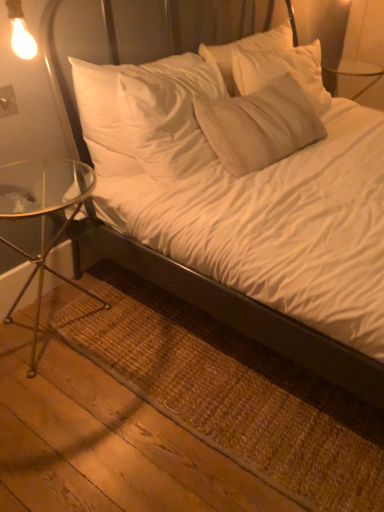
Find the location of `white soft bed at center`. white soft bed at center is located at coordinates (233, 310).

What do you see at coordinates (43, 214) in the screenshot? Image resolution: width=384 pixels, height=512 pixels. I see `clear glass table at left` at bounding box center [43, 214].

The height and width of the screenshot is (512, 384). In order to click on white soft bed at center in this screenshot , I will do `click(233, 310)`.

Which of these two, brown woven mat at lower left or clear glass table at left, is smaller?

Smaller between the two is brown woven mat at lower left.

What's the angular difference between brown woven mat at lower left and clear glass table at left's facing directions?

1.65 degrees.

From a real-world perspective, which object stands above the other?

clear glass table at left.

Is brown woven mat at lower left thinner than clear glass table at left?

No, brown woven mat at lower left is not thinner than clear glass table at left.

The image size is (384, 512). In order to click on table located underneath the white soft bed at center (from a real-world perspective) in this screenshot , I will do `click(43, 214)`.

Is white soft bed at center situated inside clear glass table at left or outside?

The correct answer is: outside.

Is white soft bed at center facing away from clear glass table at left?

white soft bed at center is not turned away from clear glass table at left.

Considering the relative sizes of white soft bed at center and clear glass table at left in the image provided, is white soft bed at center thinner than clear glass table at left?

Incorrect, the width of white soft bed at center is not less than that of clear glass table at left.

Looking at their sizes, would you say white soft bed at center is wider or thinner than brown woven mat at lower left?

white soft bed at center is wider than brown woven mat at lower left.

At what (x,y) coordinates should I click in order to perform the action: click on bed in front of the brown woven mat at lower left. Please return your answer as a coordinate pair (x, y). The image size is (384, 512). Looking at the image, I should click on (233, 310).

Is white soft bed at center spatially inside brown woven mat at lower left, or outside of it?

white soft bed at center is spatially situated outside brown woven mat at lower left.

Could you tell me if white soft bed at center is facing brown woven mat at lower left?

No, white soft bed at center is not aimed at brown woven mat at lower left.

Is clear glass table at left not near white soft bed at center?

clear glass table at left is actually quite close to white soft bed at center.

From the image's perspective, is clear glass table at left positioned above or below white soft bed at center?

From the image's perspective, clear glass table at left appears below white soft bed at center.

Is clear glass table at left to the left or to the right of white soft bed at center in the image?

clear glass table at left is to the left of white soft bed at center.

From the image's perspective, is clear glass table at left on top of brown woven mat at lower left?

Yes, from the image's perspective, clear glass table at left is on top of brown woven mat at lower left.

Could you tell me if clear glass table at left is facing brown woven mat at lower left?

Yes, clear glass table at left is facing brown woven mat at lower left.

Is clear glass table at left in contact with brown woven mat at lower left?

No, clear glass table at left is not next to brown woven mat at lower left.

Looking at the image, does clear glass table at left seem bigger or smaller compared to brown woven mat at lower left?

In the image, clear glass table at left appears to be larger than brown woven mat at lower left.

What's the angular difference between brown woven mat at lower left and white soft bed at center's facing directions?

The angular difference between brown woven mat at lower left and white soft bed at center is 1.41 degrees.

Based on the photo, considering the sizes of objects brown woven mat at lower left and white soft bed at center in the image provided, who is shorter, brown woven mat at lower left or white soft bed at center?

brown woven mat at lower left is shorter.

Could white soft bed at center be considered to be inside brown woven mat at lower left?

Definitely not — white soft bed at center is not inside brown woven mat at lower left.

I want to click on mat behind the white soft bed at center, so click(232, 393).

Where is `mat located on the right of clear glass table at left`? The image size is (384, 512). mat located on the right of clear glass table at left is located at coordinates (232, 393).

The height and width of the screenshot is (512, 384). In the image, there is a white soft bed at center. What are the coordinates of `table below it (from a real-world perspective)` in the screenshot? It's located at (43, 214).

When comparing their distances from white soft bed at center, does clear glass table at left or brown woven mat at lower left seem further?

clear glass table at left is positioned further to the anchor white soft bed at center.

When comparing their distances from clear glass table at left, does brown woven mat at lower left or white soft bed at center seem closer?

white soft bed at center is positioned closer to the anchor clear glass table at left.

When comparing their distances from white soft bed at center, does brown woven mat at lower left or clear glass table at left seem closer?

brown woven mat at lower left.

Looking at this image, when comparing their distances from brown woven mat at lower left, does clear glass table at left or white soft bed at center seem closer?

Based on the image, white soft bed at center appears to be nearer to brown woven mat at lower left.

Considering their positions, is white soft bed at center positioned further to clear glass table at left than brown woven mat at lower left?

brown woven mat at lower left lies further to clear glass table at left than the other object.

Based on their spatial positions, is white soft bed at center or clear glass table at left further from brown woven mat at lower left?

clear glass table at left is further to brown woven mat at lower left.

Identify the location of mat between clear glass table at left and white soft bed at center in the horizontal direction. This screenshot has width=384, height=512. (232, 393).